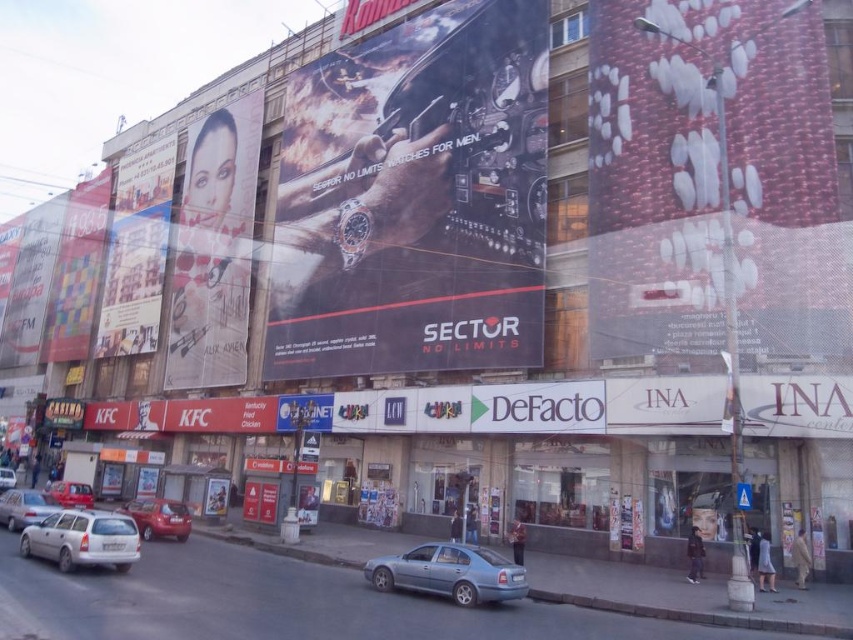
You are standing in front of the commercial building and want to touch both points on the building facade. Which point should you reach for first, point A at coordinate point A is point (521, 404) and point B is point (129, 529)? Explain your reasoning based on their positions relative to you.

You should reach for point A at coordinate point A first because it is closer to you than point B. Since point A is further to the camera than point B, it means point A is physically closer to your position in front of the building.

You are a pedestrian standing at the crosswalk in front of the commercial building. You need to cross the street to reach the entrance of the KFC restaurant on the left. Which vehicle, the light blue metallic sedan at center or the silver metallic hatchback at lower left, is closer to you as you stand at the crosswalk?

The light blue metallic sedan at center is closer to you because it is positioned below the silver metallic hatchback at lower left, meaning it is nearer to your position at the crosswalk.

In the scene shown: You are a delivery driver who needs to park your truck next to the purple matte sign at center. However, there is a silver metallic hatchback at lower left blocking the path. Can you drive around the hatchback to reach the sign without moving it?

The purple matte sign at center is not as tall as the silver metallic hatchback at lower left, so the hatchback is taller. Since the sign is shorter, driving around might not be possible if the hatchback is blocking the path physically. However, the height difference doesn not directly affect parking accessibility. You would need to assess the space around the hatchback to see if there is enough room to maneuver your truck around it without obstruction.